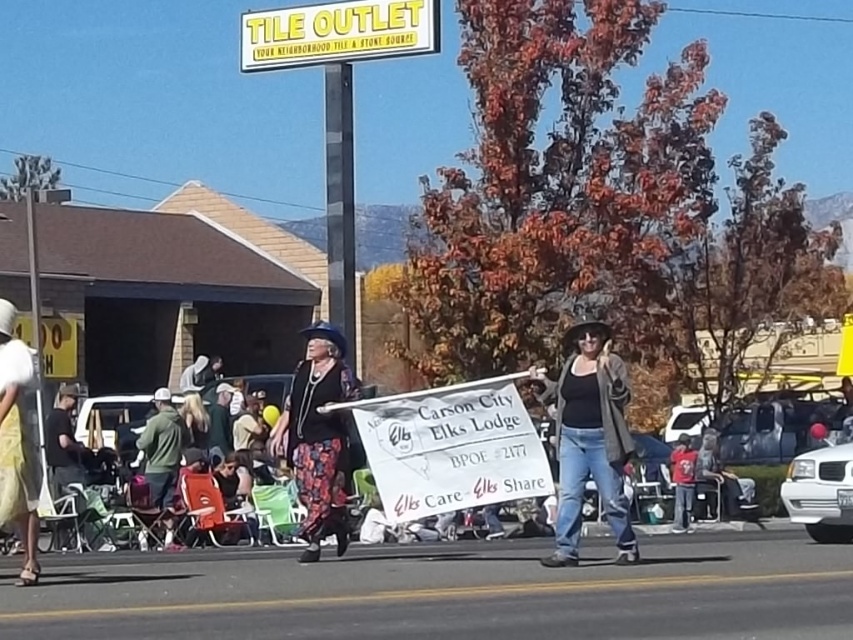
Question: From the image, what is the correct spatial relationship of yellow plastic sign at upper center in relation to red cotton shirt at center?

Choices:
 (A) above
 (B) below

Answer: (A)

Question: Where is black matte jacket at center located in relation to yellow plastic sign at upper center in the image?

Choices:
 (A) right
 (B) left

Answer: (A)

Question: Which point appears farthest from the camera in this image?

Choices:
 (A) (398, 20)
 (B) (592, 422)

Answer: (A)

Question: Among these points, which one is nearest to the camera?

Choices:
 (A) click(x=22, y=483)
 (B) click(x=679, y=472)

Answer: (A)

Question: Is floral-patterned pants at center positioned behind red cotton shirt at center?

Choices:
 (A) yes
 (B) no

Answer: (B)

Question: Estimate the real-world distances between objects in this image. Which object is farther from the yellow plastic sign at upper center?

Choices:
 (A) black matte jacket at center
 (B) yellow fabric skirt at lower left
 (C) red cotton shirt at center
 (D) floral-patterned pants at center

Answer: (B)